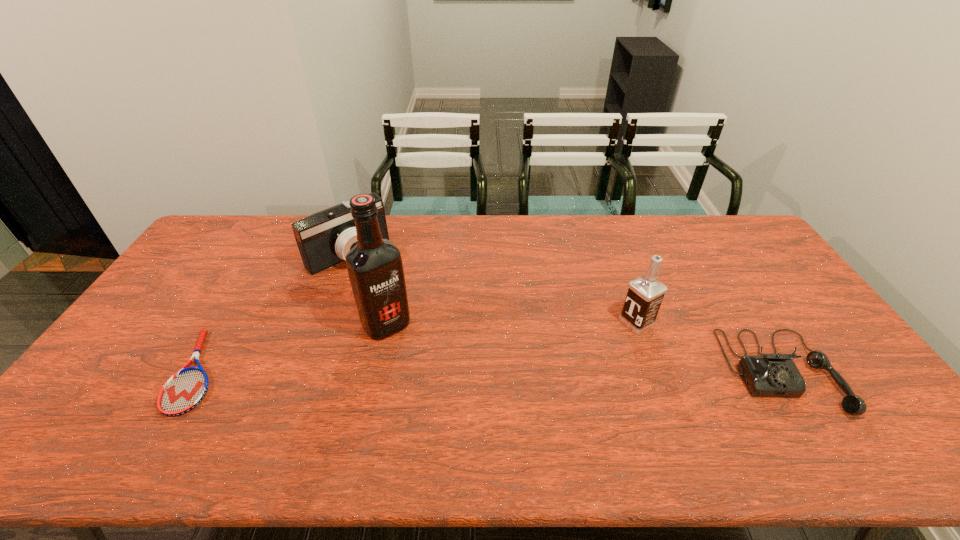
Where is `the shortest object`? the shortest object is located at coordinates (185, 390).

This screenshot has height=540, width=960. In order to click on the leftmost object in this screenshot , I will do `click(185, 390)`.

Identify the location of the fourth tallest object. The width and height of the screenshot is (960, 540). (770, 375).

Where is `telephone`? The image size is (960, 540). telephone is located at coordinates (770, 375).

Where is `the third tallest object`? The width and height of the screenshot is (960, 540). the third tallest object is located at coordinates [x=324, y=238].

Where is `camcorder`? camcorder is located at coordinates (324, 238).

Locate an element on the screen. This screenshot has width=960, height=540. liquor is located at coordinates (375, 268).

Find the location of a particular element. The image size is (960, 540). the fourth shortest object is located at coordinates (645, 294).

Where is `the second object from right to left`? The width and height of the screenshot is (960, 540). the second object from right to left is located at coordinates (645, 294).

At what (x,y) coordinates should I click in order to perform the action: click on vacant point located on the back of the tennis racket. Please return your answer as a coordinate pair (x, y). This screenshot has height=540, width=960. Looking at the image, I should click on (250, 284).